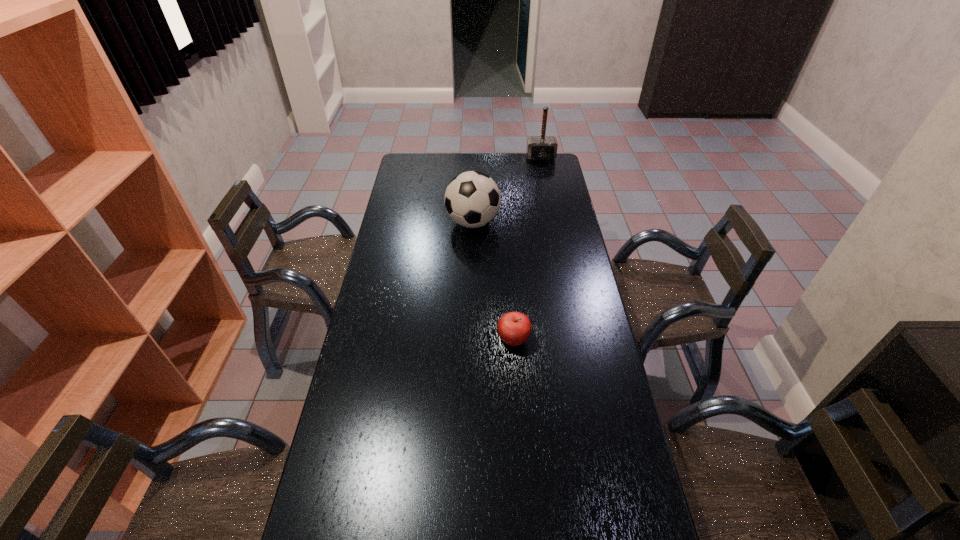
In order to click on object that is the nearest to the nearest object in this screenshot , I will do `click(472, 199)`.

Where is `free point that satisfies the following two spatial constraints: 1. on the back side of the second nearest object; 2. on the right side of the rightmost object`? The height and width of the screenshot is (540, 960). free point that satisfies the following two spatial constraints: 1. on the back side of the second nearest object; 2. on the right side of the rightmost object is located at coordinates (474, 158).